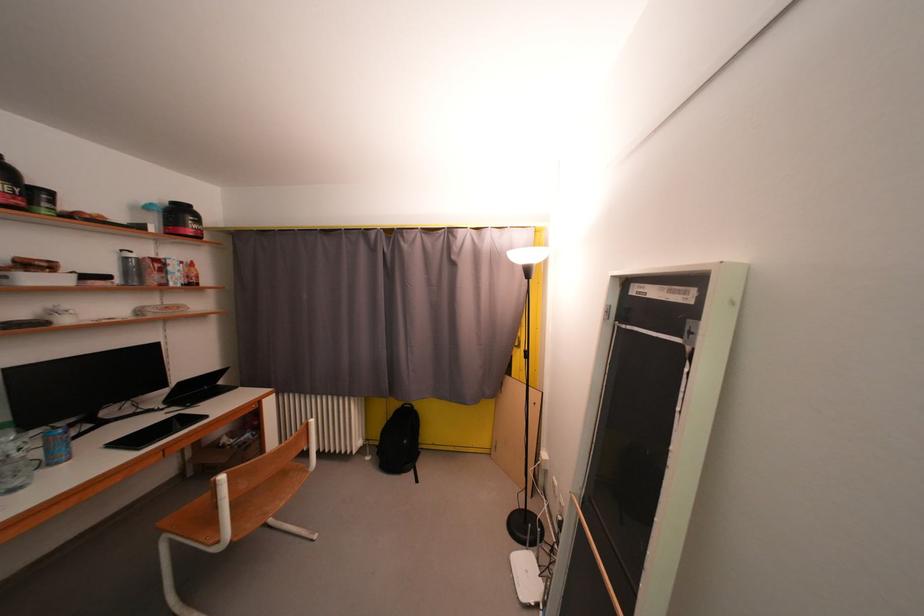
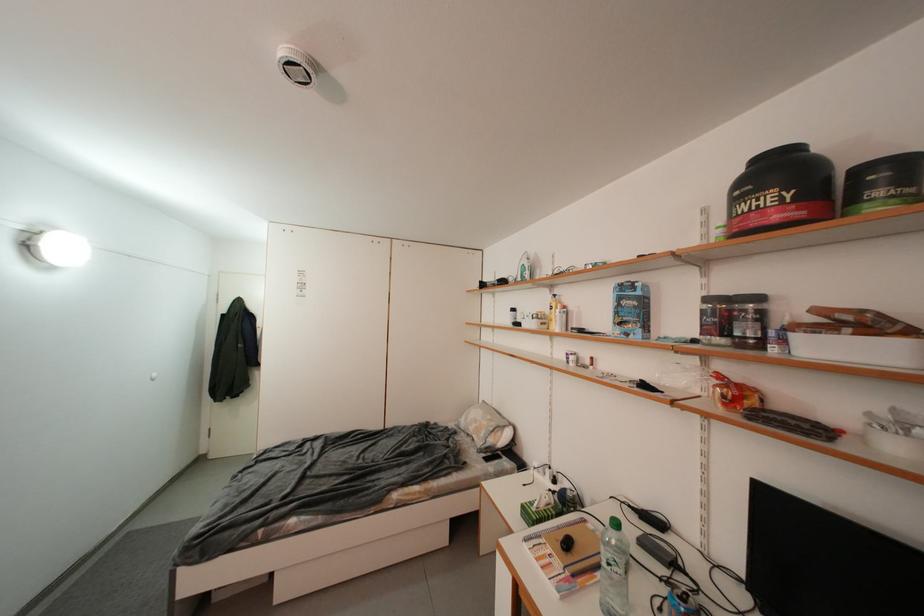
Locate, in the second image, the point that corresponds to (x=53, y=208) in the first image.

(886, 196)